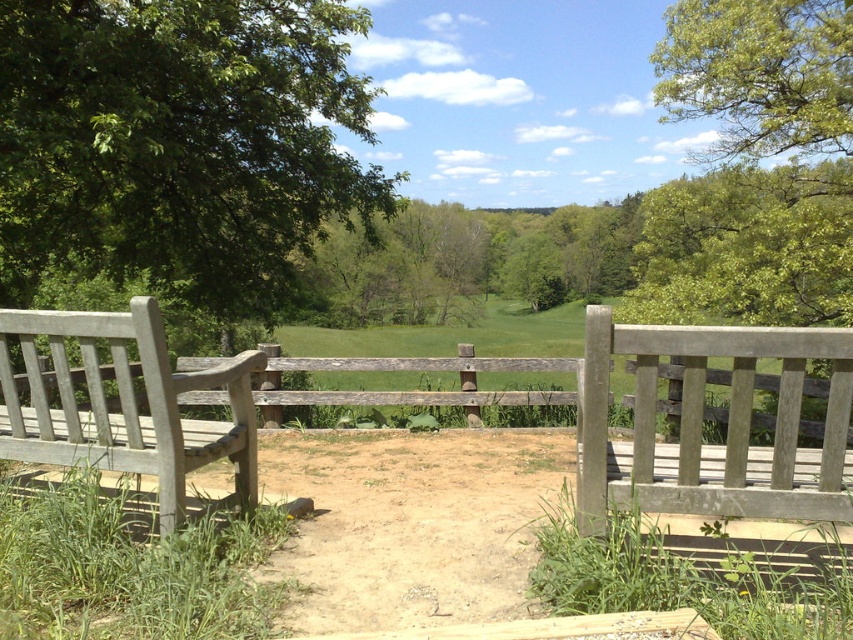
Question: Can you confirm if green leafy tree at upper left is positioned below green leafy tree at upper right?

Choices:
 (A) yes
 (B) no

Answer: (A)

Question: Can you confirm if gray wooden bench at left is positioned above green leafy tree at upper right?

Choices:
 (A) yes
 (B) no

Answer: (B)

Question: Which object appears closest to the camera in this image?

Choices:
 (A) wooden bench at center
 (B) gray wooden bench at left
 (C) green leafy tree at upper left
 (D) green leafy tree at upper right

Answer: (A)

Question: Estimate the real-world distances between objects in this image. Which object is farther from the gray wooden bench at left?

Choices:
 (A) wooden bench at center
 (B) green leafy tree at upper left

Answer: (B)

Question: Is green leafy tree at upper left to the left of gray wooden bench at left from the viewer's perspective?

Choices:
 (A) no
 (B) yes

Answer: (B)

Question: Among these points, which one is nearest to the camera?

Choices:
 (A) (608, 355)
 (B) (112, 368)
 (C) (120, 144)
 (D) (683, 72)

Answer: (A)